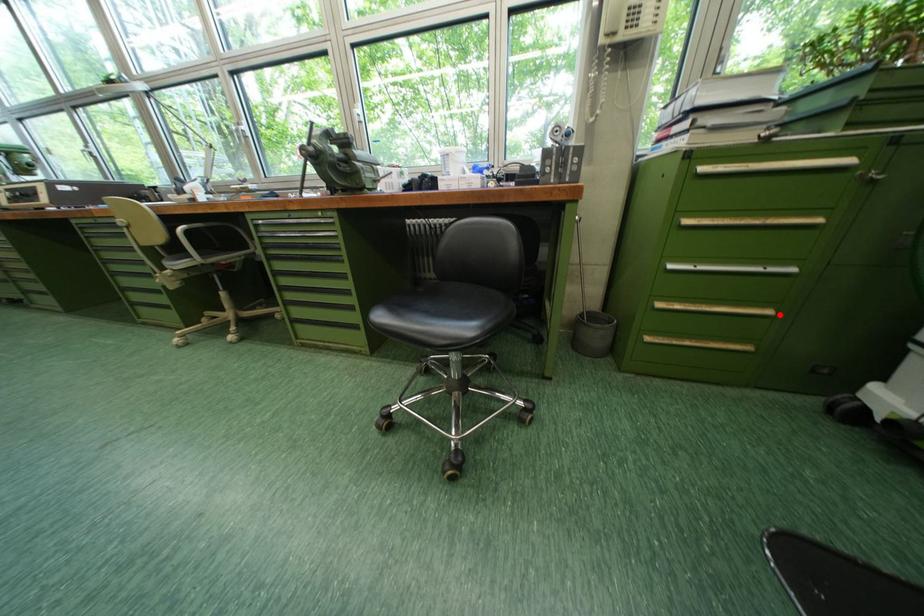
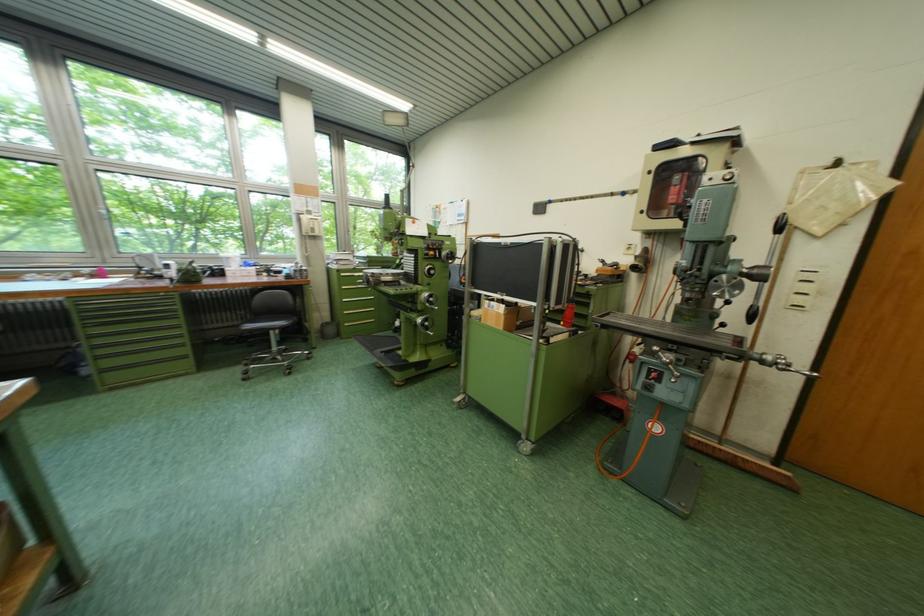
The point at the highlighted location is marked in the first image. Where is the corresponding point in the second image?

(383, 312)